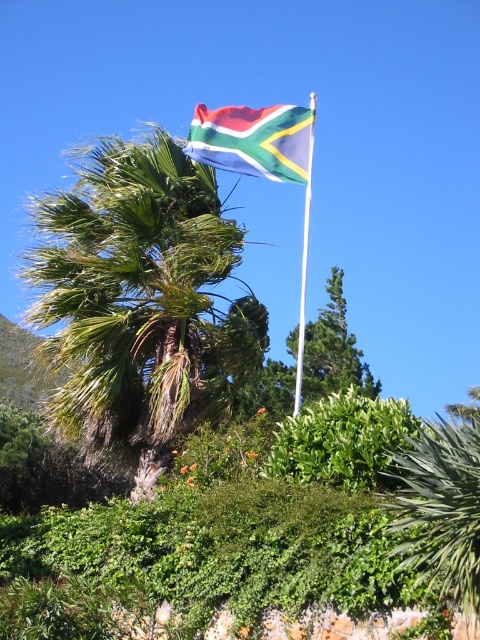
You are a photographer trying to capture the South African flag on the white metallic pole at upper center. However, you notice the green leafy palm at upper center is blocking your view. Based on their positions, can you determine if the palm is closer to you than the pole?

The green leafy palm at upper center is further to the viewer than the white metallic pole at upper center, so the palm is not closer to you. The pole is closer, so the palm would not block the view of the pole.